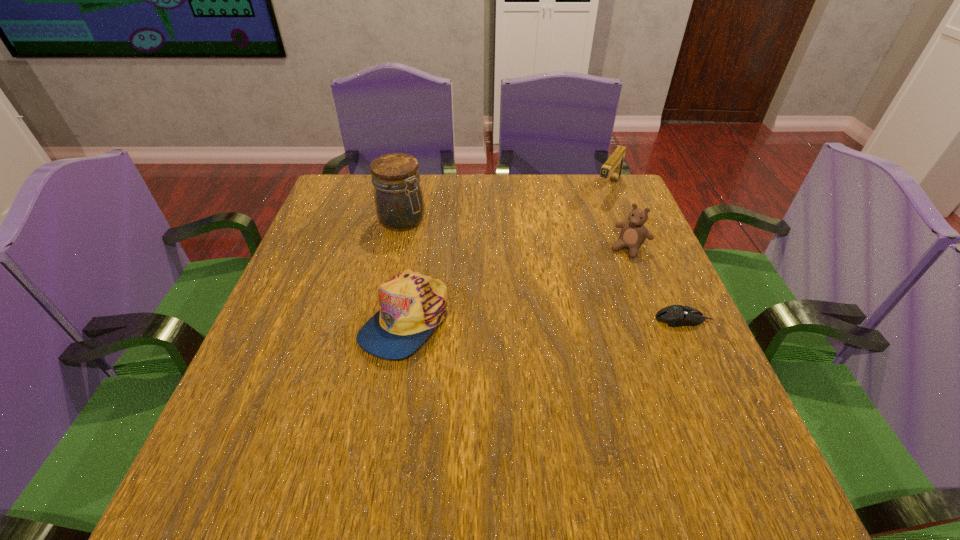
Where is `cap`? cap is located at coordinates (411, 305).

Locate an element on the screen. Image resolution: width=960 pixels, height=540 pixels. the shortest object is located at coordinates (674, 315).

This screenshot has height=540, width=960. Find the location of `the tallest object`. the tallest object is located at coordinates (398, 197).

This screenshot has height=540, width=960. What are the coordinates of `jar` in the screenshot? It's located at (398, 197).

Find the location of a particular element. The height and width of the screenshot is (540, 960). teddy bear is located at coordinates (633, 233).

Where is `the farthest object`? This screenshot has width=960, height=540. the farthest object is located at coordinates (613, 166).

I want to click on vacant space situated 0.150m on the bill of the cap, so [x=385, y=439].

Where is `vacant region located on the left of the computer mouse`? The height and width of the screenshot is (540, 960). vacant region located on the left of the computer mouse is located at coordinates (565, 319).

Locate an element on the screen. free location located on the lid of the tallest object is located at coordinates (510, 301).

Where is `vacant region located 0.170m on the lid of the tallest object`? The width and height of the screenshot is (960, 540). vacant region located 0.170m on the lid of the tallest object is located at coordinates (457, 262).